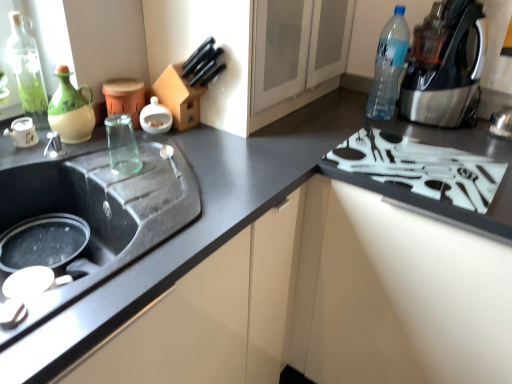
This screenshot has width=512, height=384. In order to click on vacant area to the right of green matte teapot at left in this screenshot , I will do click(x=138, y=151).